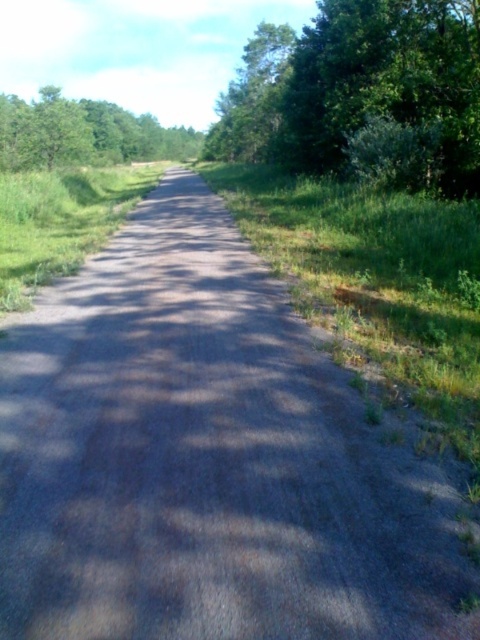
You are a hiker standing at the start of the path and want to reach the green leafy tree at upper right. Which direction should you walk to get closer to it, considering the green leafy tree at upper left is in your way?

The green leafy tree at upper right is above the green leafy tree at upper left, so you should walk towards the upper direction to reach the green leafy tree at upper right while avoiding the green leafy tree at upper left which is below it.

You are a hiker standing at the start of the path and want to know which tree is narrower between the green leafy tree at upper right and the green leafy tree at upper left. Which one should you choose?

The green leafy tree at upper right is narrower than the green leafy tree at upper left, so you should choose the green leafy tree at upper right.